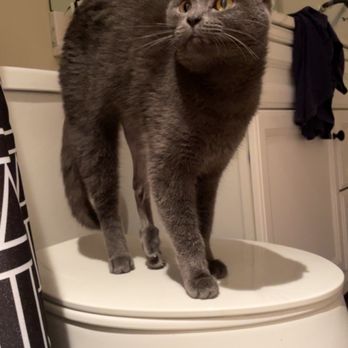
Find the location of a particular element. This screenshot has height=348, width=348. cabinet is located at coordinates [x=294, y=188].